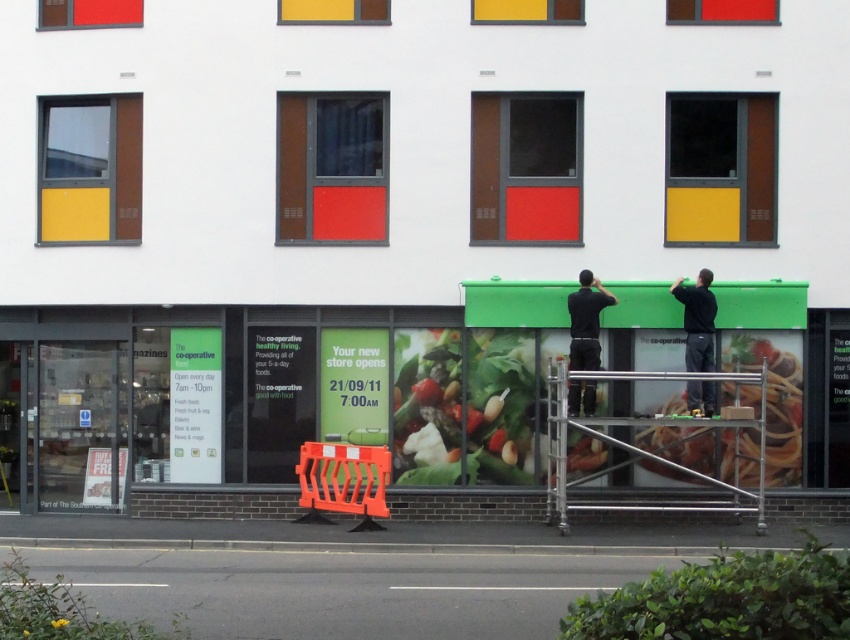
Is green matte vegetable at center bigger than dark gray shirt at center?

Actually, green matte vegetable at center might be smaller than dark gray shirt at center.

Which is below, green matte vegetable at center or dark gray shirt at center?

green matte vegetable at center is lower down.

This screenshot has height=640, width=850. Describe the element at coordinates (466, 406) in the screenshot. I see `green matte vegetable at center` at that location.

Identify the location of green matte vegetable at center. (466, 406).

Is point (502, 472) more distant than point (694, 442)?

No, (502, 472) is closer to viewer.

Does point (405, 420) come closer to viewer compared to point (785, 480)?

No, (405, 420) is behind (785, 480).

Is point (488, 468) closer to camera compared to point (757, 481)?

Yes, it is.

This screenshot has width=850, height=640. I want to click on green matte vegetable at center, so 466,406.

Can you confirm if green matte spaghetti at lower right is positioned above dark gray shirt at center?

Actually, green matte spaghetti at lower right is below dark gray shirt at center.

Locate an element on the screen. green matte spaghetti at lower right is located at coordinates (774, 394).

This screenshot has height=640, width=850. I want to click on green matte spaghetti at lower right, so click(x=774, y=394).

Identify the location of green matte spaghetti at lower right. This screenshot has width=850, height=640. (774, 394).